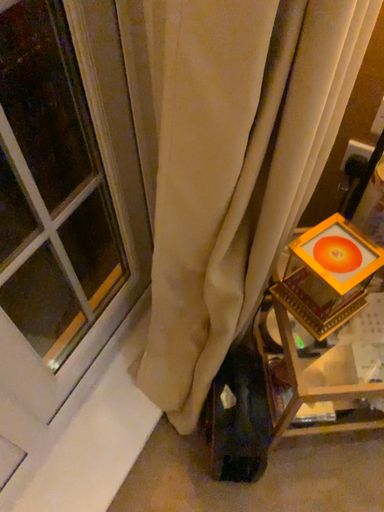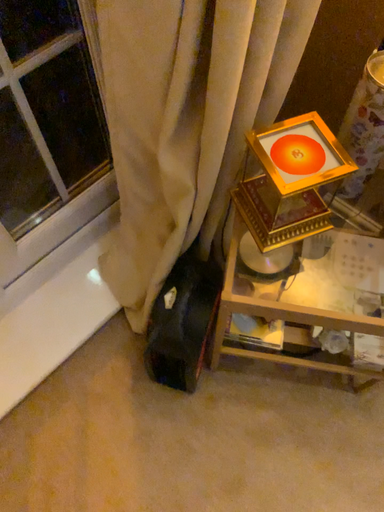
Question: Which way did the camera rotate in the video?

Choices:
 (A) rotated downward
 (B) rotated upward

Answer: (A)